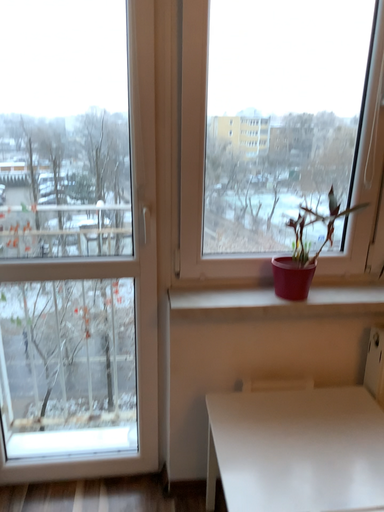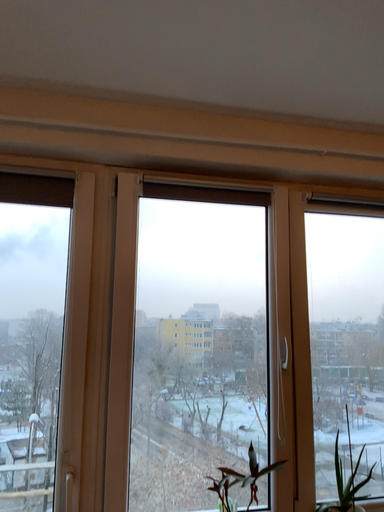
Question: Which way did the camera rotate in the video?

Choices:
 (A) rotated downward
 (B) rotated upward

Answer: (B)